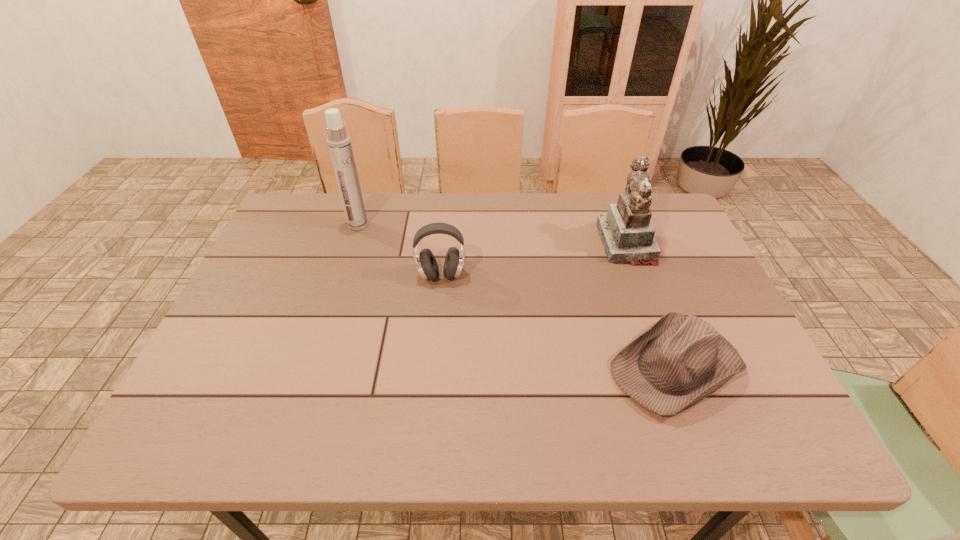
This screenshot has width=960, height=540. I want to click on blank area in the image that satisfies the following two spatial constraints: 1. on the ear cups of the fedora; 2. on the left side of the third object from right to left, so click(x=433, y=366).

This screenshot has width=960, height=540. Identify the location of free region that satisfies the following two spatial constraints: 1. on the ear cups of the third tallest object; 2. on the right side of the fedora. (433, 366).

This screenshot has width=960, height=540. Identify the location of vacant space that satisfies the following two spatial constraints: 1. on the ear cups of the third object from right to left; 2. on the right side of the nearest object. (433, 366).

Where is `vacant region that satisfies the following two spatial constraints: 1. on the front-facing side of the third shortest object; 2. on the ear cups of the second object from left to right`? vacant region that satisfies the following two spatial constraints: 1. on the front-facing side of the third shortest object; 2. on the ear cups of the second object from left to right is located at coordinates (638, 275).

You are a GUI agent. You are given a task and a screenshot of the screen. Output one action in this format:
    pyautogui.click(x=<x>, y=<y>)
    Task: Click on the free space in the image that satisfies the following two spatial constraints: 1. on the ear cups of the fedora; 2. on the left side of the headset
    This screenshot has height=540, width=960.
    Given the screenshot: What is the action you would take?
    pyautogui.click(x=433, y=366)

Locate an element on the screen. Image resolution: width=960 pixels, height=540 pixels. vacant space that satisfies the following two spatial constraints: 1. on the front-facing side of the figurine; 2. on the ear cups of the headset is located at coordinates (638, 275).

At what (x,y) coordinates should I click in order to perform the action: click on vacant space that satisfies the following two spatial constraints: 1. on the front-facing side of the nearest object; 2. on the left side of the figurine. Please return your answer as a coordinate pair (x, y). The height and width of the screenshot is (540, 960). Looking at the image, I should click on (672, 366).

Find the location of a particular element. free spot that satisfies the following two spatial constraints: 1. on the ear cups of the fedora; 2. on the right side of the second object from left to right is located at coordinates (433, 366).